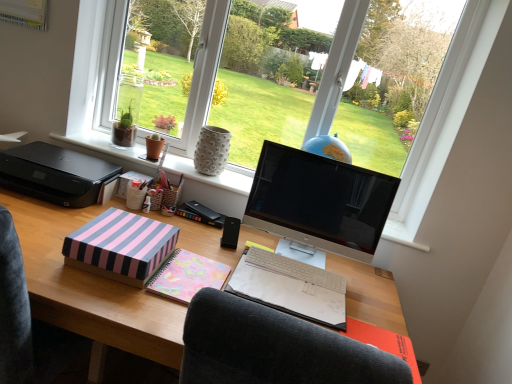
At what (x,y) coordinates should I click in order to perform the action: click on vacant space in between white plastic keyboard at center and black plastic speaker at center. Please return your answer as a coordinate pair (x, y). Looking at the image, I should click on (259, 249).